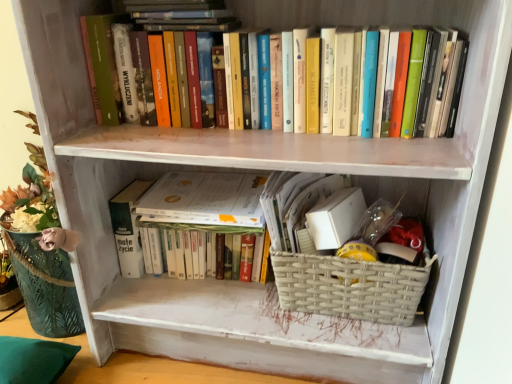
What do you see at coordinates (33, 360) in the screenshot? I see `green fabric pillow at lower left` at bounding box center [33, 360].

Locate an element on the screen. The width and height of the screenshot is (512, 384). green fabric pillow at lower left is located at coordinates (33, 360).

Can we say white paper at center lies outside woven beige basket at lower center?

Yes.

Which of these two, white paper at center or woven beige basket at lower center, is thinner?

white paper at center.

Identify the location of basket beneath the white paper at center (from a real-world perspective). (350, 287).

In terms of height, does white paper at center look taller or shorter compared to woven beige basket at lower center?

Clearly, white paper at center is shorter compared to woven beige basket at lower center.

Is hardcover books at upper center, which ranks as the first book in top-to-bottom order, thinner than hardcover book at center, the 1th book in the bottom-to-top sequence?

In fact, hardcover books at upper center, which ranks as the first book in top-to-bottom order, might be wider than hardcover book at center, the 1th book in the bottom-to-top sequence.

From a real-world perspective, between hardcover books at upper center, which ranks as the first book in top-to-bottom order, and hardcover book at center, the second book when ordered from top to bottom, who is vertically lower?

hardcover book at center, the second book when ordered from top to bottom, is physically lower.

Would you consider hardcover books at upper center, which ranks as the first book in top-to-bottom order, to be distant from hardcover book at center, the 1th book in the bottom-to-top sequence?

No, hardcover books at upper center, which ranks as the first book in top-to-bottom order, is in close proximity to hardcover book at center, the 1th book in the bottom-to-top sequence.

Based on the photo, from a real-world perspective, is white paper at center positioned above or below green fabric pillow at lower left?

white paper at center is situated higher than green fabric pillow at lower left in the real world.

Between white paper at center and green fabric pillow at lower left, which one has larger width?

Wider between the two is green fabric pillow at lower left.

Is green fabric pillow at lower left a part of white paper at center?

No, white paper at center does not contain green fabric pillow at lower left.

How distant is green fabric pillow at lower left from white paper at center?

They are 49.95 centimeters apart.

Identify the location of pillow below the white paper at center (from the image's perspective). (33, 360).

Between green fabric pillow at lower left and white paper at center, which one appears on the left side from the viewer's perspective?

green fabric pillow at lower left is more to the left.

Is hardcover book at center, the 1th book in the bottom-to-top sequence, to the left of white paper at center from the viewer's perspective?

Yes.

Who is smaller, hardcover book at center, the 1th book in the bottom-to-top sequence, or white paper at center?

With smaller size is white paper at center.

Is white paper at center at the back of hardcover book at center, the 1th book in the bottom-to-top sequence?

No, hardcover book at center, the 1th book in the bottom-to-top sequence,'s orientation is not away from white paper at center.

Could you measure the distance between hardcover book at center, the second book when ordered from top to bottom, and white paper at center?

The distance of hardcover book at center, the second book when ordered from top to bottom, from white paper at center is 0.84 inches.

Considering the sizes of white paper at center and hardcover book at center, the second book when ordered from top to bottom, in the image, is white paper at center bigger or smaller than hardcover book at center, the second book when ordered from top to bottom,?

In the image, white paper at center appears to be smaller than hardcover book at center, the second book when ordered from top to bottom.

Identify the location of paperback book above the hardcover book at center, the second book when ordered from top to bottom (from the image's perspective). The image size is (512, 384). (204, 199).

Can you confirm if white paper at center is positioned to the left of hardcover book at center, the second book when ordered from top to bottom?

Incorrect, white paper at center is not on the left side of hardcover book at center, the second book when ordered from top to bottom.

From a real-world perspective, is white paper at center above or below hardcover books at upper center, which is the 2th book from bottom to top?

white paper at center is below hardcover books at upper center, which is the 2th book from bottom to top.

Is white paper at center smaller than hardcover books at upper center, which is the 2th book from bottom to top?

Yes, white paper at center is smaller than hardcover books at upper center, which is the 2th book from bottom to top.

Based on the photo, how different are the orientations of white paper at center and hardcover books at upper center, which is the 2th book from bottom to top, in degrees?

The angle between the facing direction of white paper at center and the facing direction of hardcover books at upper center, which is the 2th book from bottom to top, is 1.72 degrees.

Where is `basket located underneath the white paper at center (from a real-world perspective)`? The width and height of the screenshot is (512, 384). basket located underneath the white paper at center (from a real-world perspective) is located at coordinates (350, 287).

The height and width of the screenshot is (384, 512). In order to click on book located in front of the hardcover book at center, the 1th book in the bottom-to-top sequence in this screenshot , I will do `click(350, 13)`.

Based on their spatial positions, is woven beige basket at lower center or green fabric pillow at lower left further from white paper at center?

The object further to white paper at center is green fabric pillow at lower left.

Based on their spatial positions, is woven beige basket at lower center or white paper at center further from green fabric pillow at lower left?

Among the two, woven beige basket at lower center is located further to green fabric pillow at lower left.

Based on their spatial positions, is hardcover book at center, the second book when ordered from top to bottom, or hardcover books at upper center, which is the 2th book from bottom to top, closer to woven beige basket at lower center?

Based on the image, hardcover book at center, the second book when ordered from top to bottom, appears to be nearer to woven beige basket at lower center.

Estimate the real-world distances between objects in this image. Which object is closer to green fabric pillow at lower left, white paper at center or hardcover book at center, the second book when ordered from top to bottom?

hardcover book at center, the second book when ordered from top to bottom, is closer to green fabric pillow at lower left.

Estimate the real-world distances between objects in this image. Which object is further from hardcover book at center, the 1th book in the bottom-to-top sequence, hardcover books at upper center, which is the 2th book from bottom to top, or woven beige basket at lower center?

hardcover books at upper center, which is the 2th book from bottom to top, is positioned further to the anchor hardcover book at center, the 1th book in the bottom-to-top sequence.

Considering their positions, is white paper at center positioned further to woven beige basket at lower center than hardcover books at upper center, which ranks as the first book in top-to-bottom order?

hardcover books at upper center, which ranks as the first book in top-to-bottom order, is positioned further to the anchor woven beige basket at lower center.

Looking at the image, which one is located closer to green fabric pillow at lower left, hardcover book at center, the second book when ordered from top to bottom, or hardcover books at upper center, which ranks as the first book in top-to-bottom order?

hardcover book at center, the second book when ordered from top to bottom, lies closer to green fabric pillow at lower left than the other object.

Estimate the real-world distances between objects in this image. Which object is further from hardcover books at upper center, which is the 2th book from bottom to top, white paper at center or green fabric pillow at lower left?

Among the two, green fabric pillow at lower left is located further to hardcover books at upper center, which is the 2th book from bottom to top.

The width and height of the screenshot is (512, 384). What are the coordinates of `paperback book that lies between hardcover books at upper center, which is the 2th book from bottom to top, and green fabric pillow at lower left from top to bottom` in the screenshot? It's located at (204, 199).

At what (x,y) coordinates should I click in order to perform the action: click on paperback book between hardcover book at center, the 1th book in the bottom-to-top sequence, and woven beige basket at lower center. Please return your answer as a coordinate pair (x, y). This screenshot has height=384, width=512. Looking at the image, I should click on (204, 199).

Identify the location of paperback book situated between green fabric pillow at lower left and woven beige basket at lower center from left to right. tap(204, 199).

The image size is (512, 384). I want to click on paperback book between hardcover books at upper center, which ranks as the first book in top-to-bottom order, and woven beige basket at lower center in the up-down direction, so click(x=204, y=199).